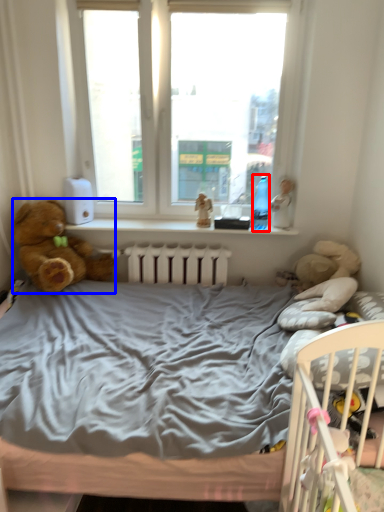
Question: Among these objects, which one is nearest to the camera, bottle (highlighted by a red box) or teddy bear (highlighted by a blue box)?

Choices:
 (A) bottle
 (B) teddy bear

Answer: (B)